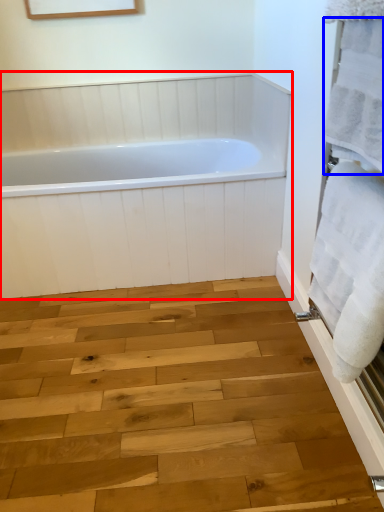
Question: Which object appears closest to the camera in this image, bathtub (highlighted by a red box) or bath towel (highlighted by a blue box)?

Choices:
 (A) bathtub
 (B) bath towel

Answer: (B)